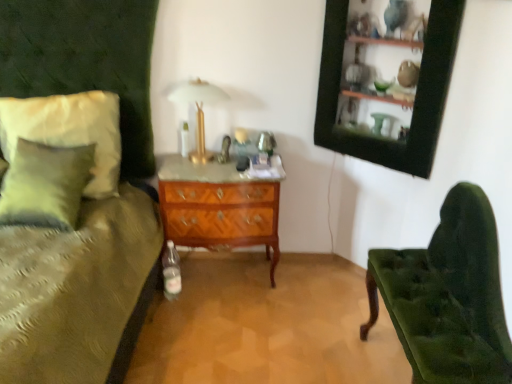
Locate an element on the screen. free region under woodenwoodenchest of drawers at center (from a real-world perspective) is located at coordinates [223, 273].